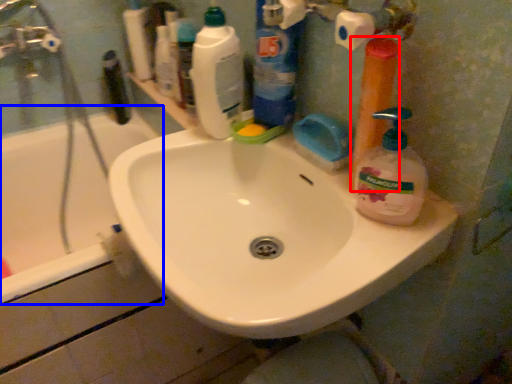
Question: Among these objects, which one is nearest to the camera, cleaning product (highlighted by a red box) or bathtub (highlighted by a blue box)?

Choices:
 (A) cleaning product
 (B) bathtub

Answer: (A)